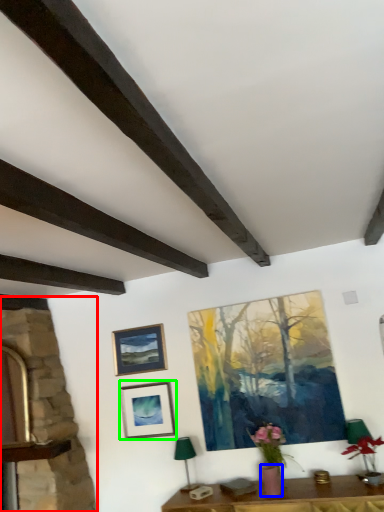
Question: Which object is positioned closest to fireplace (highlighted by a red box)? Select from flowerpot (highlighted by a blue box) and picture frame (highlighted by a green box).

Choices:
 (A) flowerpot
 (B) picture frame

Answer: (B)